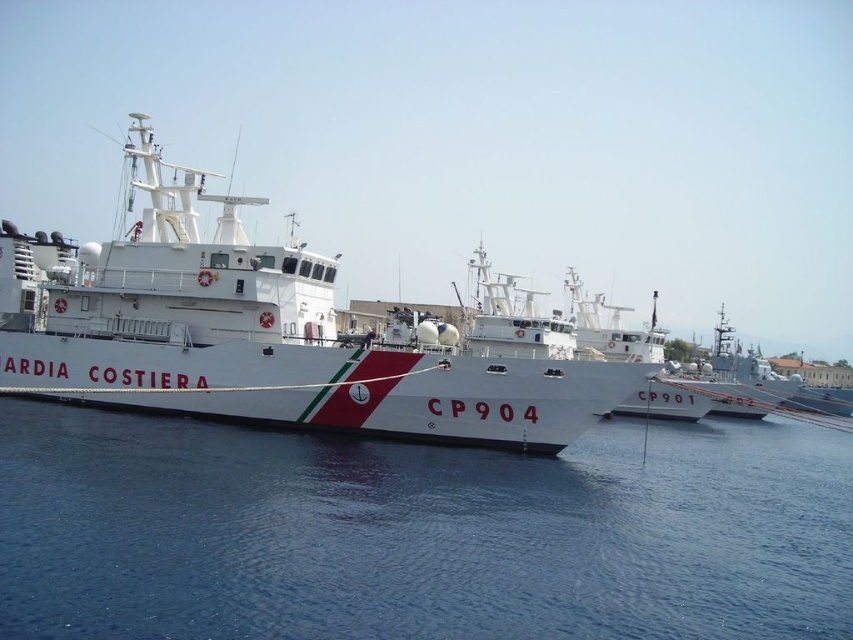
Question: Can you confirm if blue water at lower left is positioned above white glossy ship at center?

Choices:
 (A) yes
 (B) no

Answer: (B)

Question: Which object appears farthest from the camera in this image?

Choices:
 (A) white glossy ship at center
 (B) blue water at lower left

Answer: (A)

Question: Is the position of blue water at lower left less distant than that of white glossy ship at center?

Choices:
 (A) no
 (B) yes

Answer: (B)

Question: Can you confirm if blue water at lower left is positioned above white glossy ship at center?

Choices:
 (A) yes
 (B) no

Answer: (B)

Question: Which object is farther from the camera taking this photo?

Choices:
 (A) blue water at lower left
 (B) white glossy ship at center

Answer: (B)